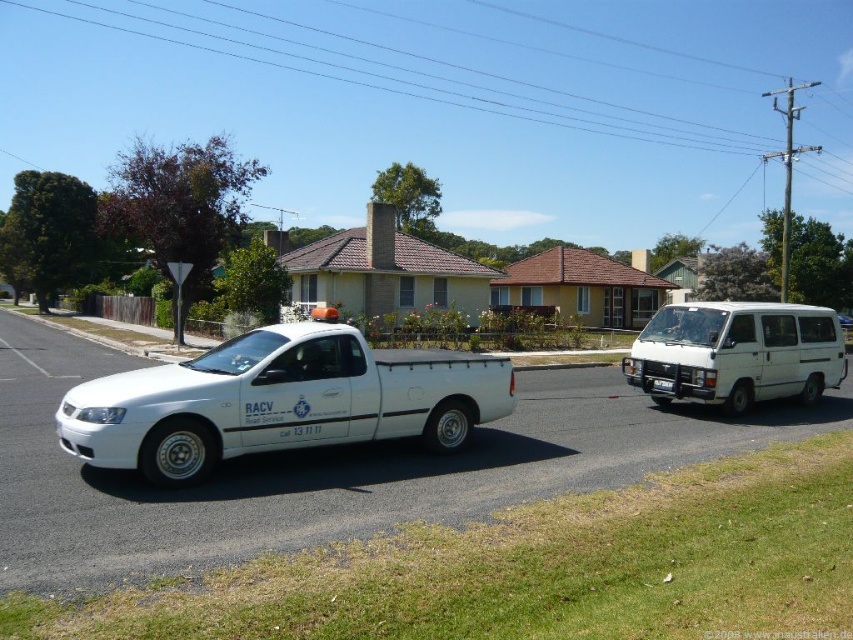
Who is positioned more to the right, white matte pickup truck at center or white matte van at right?

white matte van at right is more to the right.

Who is taller, white matte pickup truck at center or white matte van at right?

Standing taller between the two is white matte van at right.

Find the location of a particular element. white matte pickup truck at center is located at coordinates (279, 401).